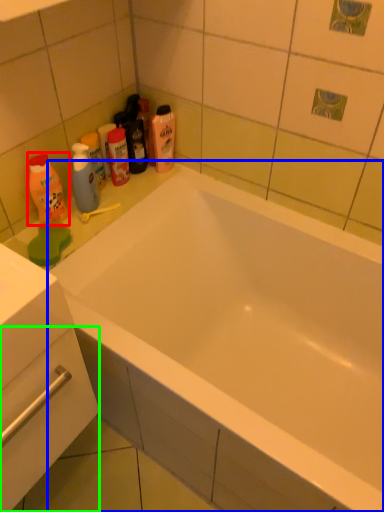
Question: Estimate the real-world distances between objects in this image. Which object is closer to cleaning product (highlighted by a red box), bathtub (highlighted by a blue box) or drawer (highlighted by a green box)?

Choices:
 (A) bathtub
 (B) drawer

Answer: (B)